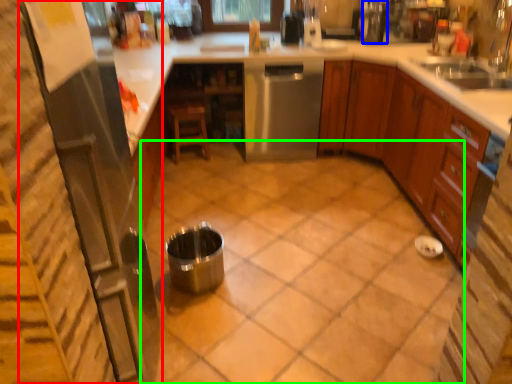
Question: Which object is positioned closest to appliance (highlighted by a red box)? Select from appliance (highlighted by a blue box) and tile (highlighted by a green box).

Choices:
 (A) appliance
 (B) tile

Answer: (B)